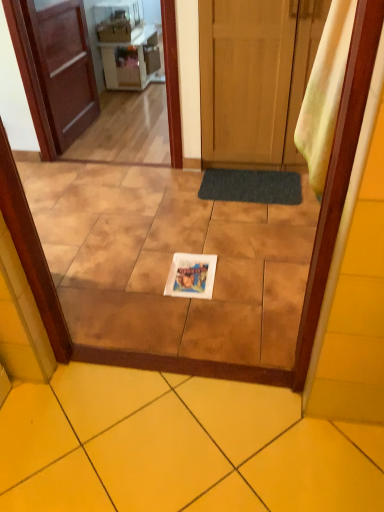
Where is `free location to the right of white glossy book at center`? free location to the right of white glossy book at center is located at coordinates (242, 275).